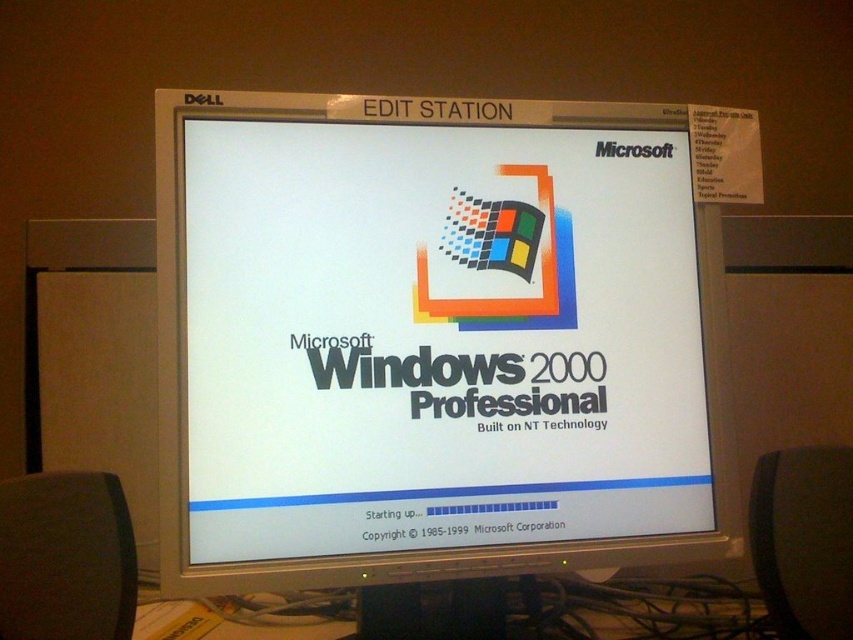
Which is more to the left, white glossy monitor at center or multicolored pixelated square at center?

white glossy monitor at center

Which of these two, white glossy monitor at center or multicolored pixelated square at center, stands shorter?

multicolored pixelated square at center

Where is `white glossy monitor at center`? The height and width of the screenshot is (640, 853). white glossy monitor at center is located at coordinates (436, 340).